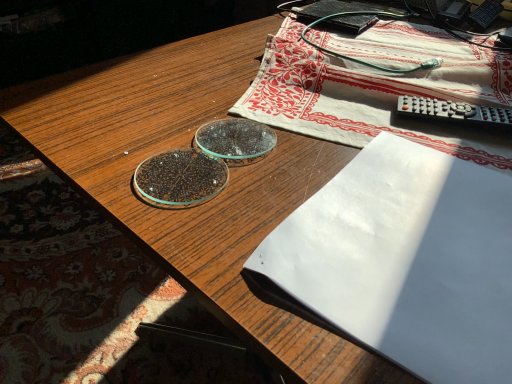
You are a GUI agent. You are given a task and a screenshot of the screen. Output one action in this format:
    pyautogui.click(x=<x>, y=<y>)
    Task: Click on the blank space above white paper at center (from a real-world perspective)
    The image size is (512, 384).
    Given the screenshot: What is the action you would take?
    pyautogui.click(x=426, y=237)